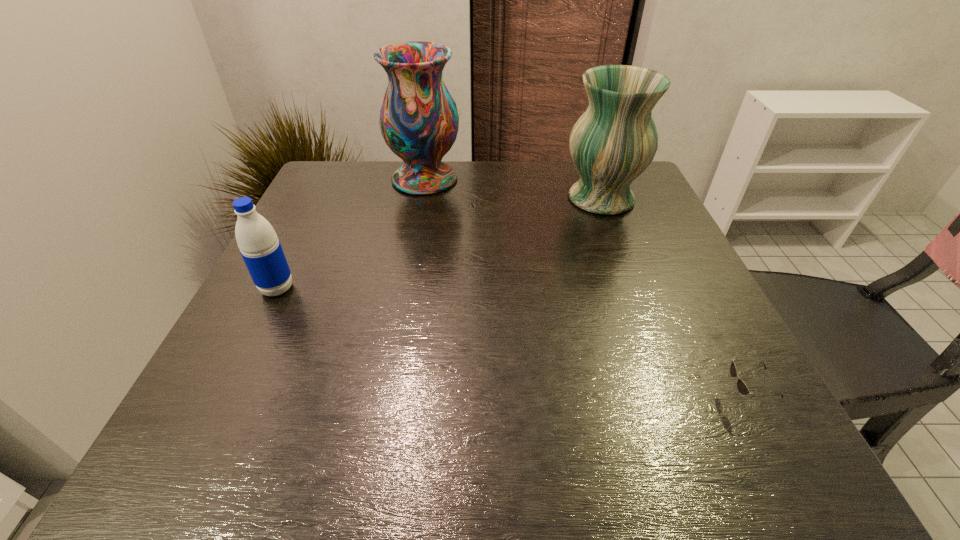
Image resolution: width=960 pixels, height=540 pixels. What are the coordinates of `vacant region at the left edge of the desktop` in the screenshot? It's located at (224, 369).

At what (x,y) coordinates should I click in order to perform the action: click on blank area at the right edge. Please return your answer as a coordinate pair (x, y). The height and width of the screenshot is (540, 960). Looking at the image, I should click on [610, 222].

What are the coordinates of `vacant space at the far left corner of the desktop` in the screenshot? It's located at (347, 201).

The width and height of the screenshot is (960, 540). Identify the location of vacant space at the near left corner of the desktop. (232, 430).

Identify the location of free space between the water bottle and the sunglasses. The image size is (960, 540). (511, 343).

What are the coordinates of `vacant area between the nearest object and the left vase` in the screenshot? It's located at (585, 288).

Locate an element on the screen. This screenshot has height=540, width=960. empty space between the nearest object and the right vase is located at coordinates (672, 298).

Locate an element on the screen. The height and width of the screenshot is (540, 960). vacant point located between the third tallest object and the right vase is located at coordinates (439, 244).

This screenshot has height=540, width=960. Find the location of `free space between the nearest object and the second object from left to right`. free space between the nearest object and the second object from left to right is located at coordinates (585, 288).

The image size is (960, 540). What are the coordinates of `free space between the nearest object and the right vase` in the screenshot? It's located at (672, 298).